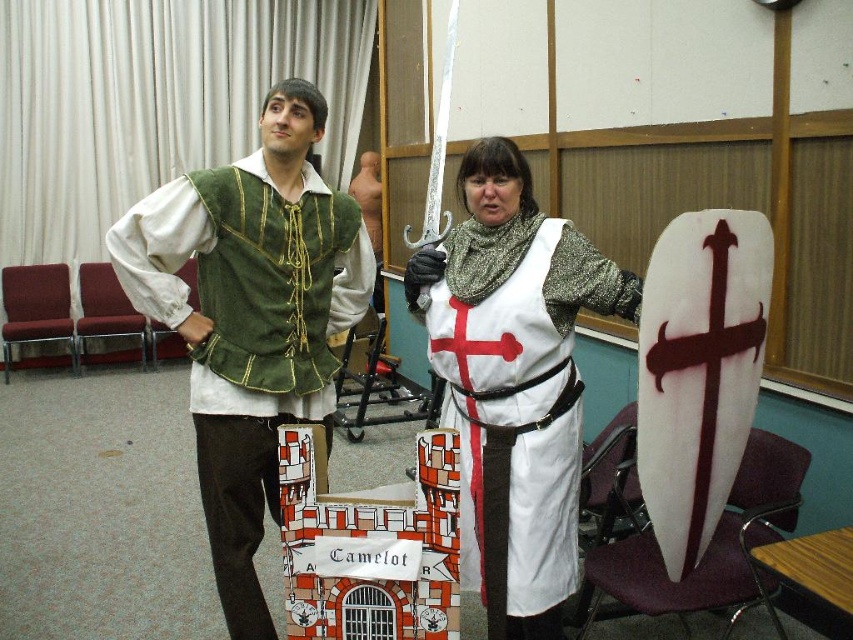
Find the location of a particular element. green velvet vest at left is located at coordinates tap(247, 333).

Is green velvet vest at left taller than white fabric with red cross at center?

Indeed, green velvet vest at left has a greater height compared to white fabric with red cross at center.

Who is more forward, (247, 502) or (462, 413)?

Point (462, 413)

Find the location of a particular element. This screenshot has width=853, height=640. green velvet vest at left is located at coordinates (247, 333).